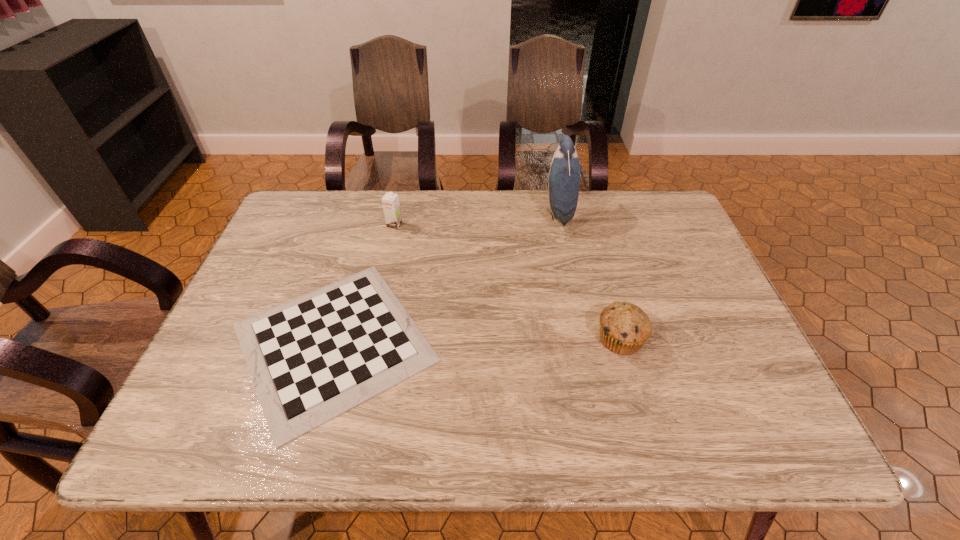
Locate an element on the screen. Image resolution: width=960 pixels, height=540 pixels. the tallest object is located at coordinates (564, 175).

This screenshot has height=540, width=960. Identify the location of chocolate milk. (390, 201).

At what (x,y) coordinates should I click in order to perform the action: click on muffin. Please return your answer as a coordinate pair (x, y). Looking at the image, I should click on (624, 328).

The height and width of the screenshot is (540, 960). I want to click on the shortest object, so 312,358.

Locate an element on the screen. vacant space located 0.320m at the tip of the bird's beak is located at coordinates (441, 213).

Locate an element on the screen. The height and width of the screenshot is (540, 960). vacant space located at the tip of the bird's beak is located at coordinates (502, 213).

The width and height of the screenshot is (960, 540). I want to click on vacant region located at the tip of the bird's beak, so click(441, 213).

Identify the location of free space located 0.160m on the front of the chocolate milk. This screenshot has width=960, height=540. (385, 266).

This screenshot has width=960, height=540. What are the coordinates of `free space located on the back of the muffin` in the screenshot? It's located at (597, 255).

At what (x,y) coordinates should I click in order to perform the action: click on vacant area located on the back of the chessboard. Please return your answer as a coordinate pair (x, y). The width and height of the screenshot is (960, 540). Looking at the image, I should click on (372, 211).